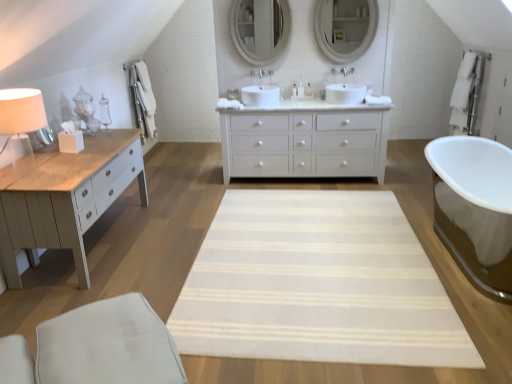
Based on the photo, in order to face white ceramic faucet at center, the 1th faucet viewed from the left, should I rotate leftwards or rightwards?

It's best to rotate right around 1.007 degrees.

What do you see at coordinates (97, 347) in the screenshot? I see `white fabric swivel chair at lower left` at bounding box center [97, 347].

This screenshot has height=384, width=512. Describe the element at coordinates (304, 140) in the screenshot. I see `white painted wood chest of drawers at center` at that location.

Identify the location of translucent glass bottle at center. (308, 90).

The image size is (512, 384). What are the coordinates of `white ceramic faucet at center, the second faucet when ordered from left to right` in the screenshot? It's located at (270, 72).

Find the location of a particular element. The width and height of the screenshot is (512, 384). white ceramic faucet at center, placed as the 2th faucet when sorted from right to left is located at coordinates (261, 73).

Between white ceramic faucet at center, the 1th faucet viewed from the left, and white painted wood chest of drawers at center, which one is positioned in front?

white painted wood chest of drawers at center is more forward.

Does white ceramic faucet at center, placed as the 2th faucet when sorted from right to left, have a lesser height compared to white painted wood chest of drawers at center?

Correct, white ceramic faucet at center, placed as the 2th faucet when sorted from right to left, is not as tall as white painted wood chest of drawers at center.

Looking at their sizes, would you say white ceramic faucet at center, placed as the 2th faucet when sorted from right to left, is wider or thinner than white painted wood chest of drawers at center?

In the image, white ceramic faucet at center, placed as the 2th faucet when sorted from right to left, appears to be more narrow than white painted wood chest of drawers at center.

Is white ceramic faucet at center, the second faucet when ordered from left to right, to the left of white ceramic faucet at center, placed as the 2th faucet when sorted from right to left, from the viewer's perspective?

Incorrect, white ceramic faucet at center, the second faucet when ordered from left to right, is not on the left side of white ceramic faucet at center, placed as the 2th faucet when sorted from right to left.

Are white ceramic faucet at center, which is the first faucet from right to left, and white ceramic faucet at center, placed as the 2th faucet when sorted from right to left, beside each other?

Yes, white ceramic faucet at center, which is the first faucet from right to left, is with white ceramic faucet at center, placed as the 2th faucet when sorted from right to left.

Is white ceramic faucet at center, the 1th faucet viewed from the left, at the back of white ceramic faucet at center, which is the first faucet from right to left?

That's not correct — white ceramic faucet at center, which is the first faucet from right to left, is not looking away from white ceramic faucet at center, the 1th faucet viewed from the left.

Is white ceramic faucet at center, the second faucet when ordered from left to right, taller than white ceramic faucet at center, placed as the 2th faucet when sorted from right to left?

Incorrect, the height of white ceramic faucet at center, the second faucet when ordered from left to right, is not larger of that of white ceramic faucet at center, placed as the 2th faucet when sorted from right to left.

Is matte white lampshade at left with white ceramic faucet at center, the second faucet when ordered from left to right?

No, matte white lampshade at left is not in contact with white ceramic faucet at center, the second faucet when ordered from left to right.

Relative to white ceramic faucet at center, which is the first faucet from right to left, is matte white lampshade at left in front or behind?

Visually, matte white lampshade at left is located in front of white ceramic faucet at center, which is the first faucet from right to left.

Is matte white lampshade at left wider or thinner than white ceramic faucet at center, which is the first faucet from right to left?

Clearly, matte white lampshade at left has more width compared to white ceramic faucet at center, which is the first faucet from right to left.

Between matte white lampshade at left and white ceramic faucet at center, the second faucet when ordered from left to right, which one appears on the right side from the viewer's perspective?

white ceramic faucet at center, the second faucet when ordered from left to right, is more to the right.

The image size is (512, 384). Find the location of `table lamp above the beige striped rug at center (from the image's perspective)`. table lamp above the beige striped rug at center (from the image's perspective) is located at coordinates (21, 124).

Does point (14, 129) come in front of point (408, 305)?

That is True.

From the image's perspective, is matte white lampshade at left on top of beige striped rug at center?

Correct, matte white lampshade at left appears higher than beige striped rug at center in the image.

Looking at this image, can you confirm if matte white lampshade at left is positioned to the right of beige striped rug at center?

No, matte white lampshade at left is not to the right of beige striped rug at center.

Based on the photo, who is shorter, white fabric swivel chair at lower left or matte white lampshade at left?

Standing shorter between the two is white fabric swivel chair at lower left.

From a real-world perspective, which is physically above, white fabric swivel chair at lower left or matte white lampshade at left?

matte white lampshade at left, from a real-world perspective.

Is white fabric swivel chair at lower left oriented away from matte white lampshade at left?

No, matte white lampshade at left is not at the back of white fabric swivel chair at lower left.

From a real-world perspective, which is physically below, white fabric swivel chair at lower left or white painted wood chest of drawers at center?

white fabric swivel chair at lower left.

Is white painted wood chest of drawers at center a part of white fabric swivel chair at lower left?

Definitely not — white painted wood chest of drawers at center is not inside white fabric swivel chair at lower left.

Who is taller, white fabric swivel chair at lower left or white painted wood chest of drawers at center?

Standing taller between the two is white painted wood chest of drawers at center.

From a real-world perspective, relative to white fabric swivel chair at lower left, is white ceramic faucet at center, which is the first faucet from right to left, vertically above or below?

white ceramic faucet at center, which is the first faucet from right to left, is situated higher than white fabric swivel chair at lower left in the real world.

Can you confirm if white ceramic faucet at center, the second faucet when ordered from left to right, is shorter than white fabric swivel chair at lower left?

Indeed, white ceramic faucet at center, the second faucet when ordered from left to right, has a lesser height compared to white fabric swivel chair at lower left.

Is white ceramic faucet at center, which is the first faucet from right to left, directly adjacent to white fabric swivel chair at lower left?

No.

From the image's perspective, is white ceramic faucet at center, the second faucet when ordered from left to right, positioned above or below white fabric swivel chair at lower left?

Based on their image positions, white ceramic faucet at center, the second faucet when ordered from left to right, is located above white fabric swivel chair at lower left.

There is a white painted wood chest of drawers at center. Where is `the 1st faucet above it (from a real-world perspective)`? the 1st faucet above it (from a real-world perspective) is located at coordinates (261, 73).

Locate an element on the screen. faucet that is on the right side of white ceramic faucet at center, the 1th faucet viewed from the left is located at coordinates (270, 72).

Based on their spatial positions, is white ceramic faucet at center, the 1th faucet viewed from the left, or matte white lampshade at left closer to white ceramic faucet at center, which is the first faucet from right to left?

The object closer to white ceramic faucet at center, which is the first faucet from right to left, is white ceramic faucet at center, the 1th faucet viewed from the left.

Based on their spatial positions, is white ceramic faucet at center, the 1th faucet viewed from the left, or white painted wood chest of drawers at center further from white ceramic faucet at center, the second faucet when ordered from left to right?

Among the two, white painted wood chest of drawers at center is located further to white ceramic faucet at center, the second faucet when ordered from left to right.

From the image, which object appears to be farther from matte white lampshade at left, white painted wood chest of drawers at center or translucent glass bottle at center?

translucent glass bottle at center.

Based on their spatial positions, is white ceramic faucet at center, the 1th faucet viewed from the left, or translucent glass bottle at center closer to white painted wood chest of drawers at center?

Among the two, translucent glass bottle at center is located nearer to white painted wood chest of drawers at center.

Looking at the image, which one is located closer to translucent glass bottle at center, matte white lampshade at left or white ceramic faucet at center, the second faucet when ordered from left to right?

white ceramic faucet at center, the second faucet when ordered from left to right, is positioned closer to the anchor translucent glass bottle at center.

Estimate the real-world distances between objects in this image. Which object is closer to white painted wood chest of drawers at center, translucent glass bottle at center or beige striped rug at center?

translucent glass bottle at center lies closer to white painted wood chest of drawers at center than the other object.

When comparing their distances from white ceramic faucet at center, which is the first faucet from right to left, does translucent glass bottle at center or matte white lampshade at left seem closer?

translucent glass bottle at center.

Estimate the real-world distances between objects in this image. Which object is further from beige striped rug at center, matte white lampshade at left or white ceramic faucet at center, placed as the 2th faucet when sorted from right to left?

Among the two, white ceramic faucet at center, placed as the 2th faucet when sorted from right to left, is located further to beige striped rug at center.

I want to click on table lamp between beige striped rug at center and white ceramic faucet at center, the second faucet when ordered from left to right, from front to back, so click(x=21, y=124).

Locate an element on the screen. faucet between matte white lampshade at left and white ceramic faucet at center, which is the first faucet from right to left, along the z-axis is located at coordinates (261, 73).

Locate an element on the screen. The height and width of the screenshot is (384, 512). mat between white fabric swivel chair at lower left and translucent glass bottle at center in the front-back direction is located at coordinates (317, 284).

You are a GUI agent. You are given a task and a screenshot of the screen. Output one action in this format:
    pyautogui.click(x=<x>, y=<y>)
    Task: Click on the faucet between white ceramic faucet at center, which is the first faucet from right to left, and white painted wood chest of drawers at center from top to bottom
    This screenshot has width=512, height=384.
    Given the screenshot: What is the action you would take?
    pyautogui.click(x=261, y=73)